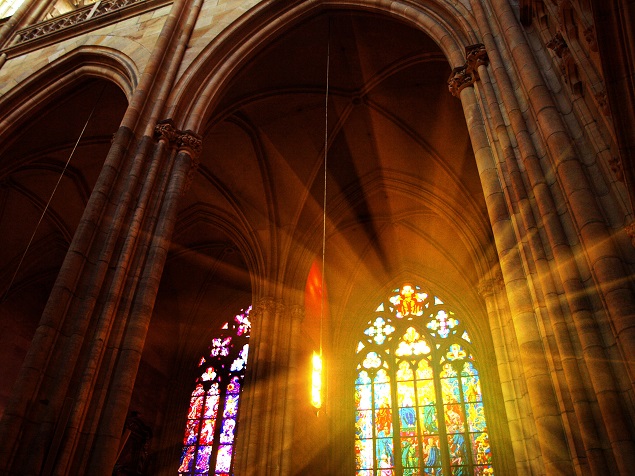
The image size is (635, 476). I want to click on pink stained glass pane, left of center, so click(x=234, y=383).